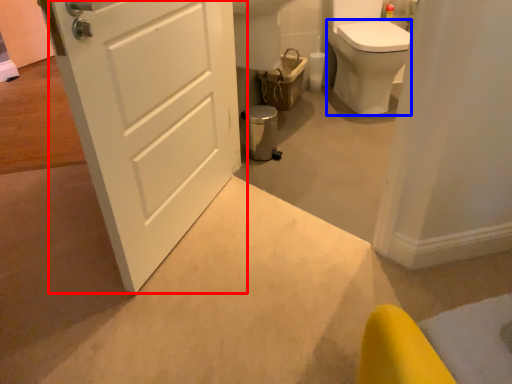
Question: Which object is further to the camera taking this photo, door (highlighted by a red box) or bidet (highlighted by a blue box)?

Choices:
 (A) door
 (B) bidet

Answer: (B)